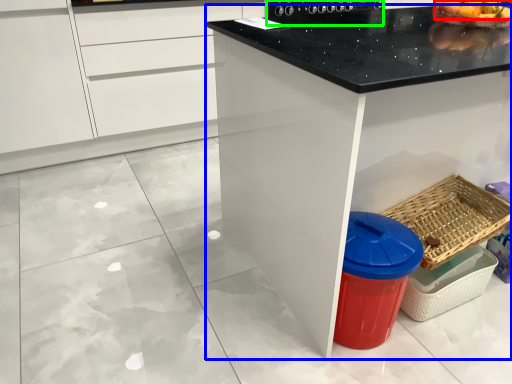
Question: Which is nearer to the fruit (highlighted by a red box)? countertop (highlighted by a blue box) or appliance (highlighted by a green box).

Choices:
 (A) countertop
 (B) appliance

Answer: (B)